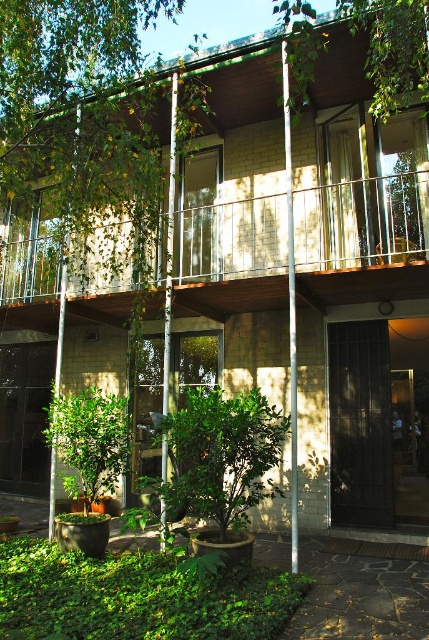
Is green wood balcony at upper center below green leafy plant at lower center?

Incorrect, green wood balcony at upper center is not positioned below green leafy plant at lower center.

This screenshot has width=429, height=640. Describe the element at coordinates (202, 189) in the screenshot. I see `green wood balcony at upper center` at that location.

Locate an element on the screen. green wood balcony at upper center is located at coordinates (202, 189).

Does green leafy tree at center appear on the right side of green leafy plant at lower center?

No, green leafy tree at center is not to the right of green leafy plant at lower center.

Locate an element on the screen. green leafy tree at center is located at coordinates (81, 115).

Describe the element at coordinates (81, 115) in the screenshot. This screenshot has width=429, height=640. I see `green leafy tree at center` at that location.

Find the location of a particular element. This screenshot has height=640, width=429. green leafy tree at center is located at coordinates (81, 115).

Looking at this image, can you confirm if green wood balcony at upper center is wider than green leafy tree at center?

Incorrect, green wood balcony at upper center's width does not surpass green leafy tree at center's.

What do you see at coordinates (202, 189) in the screenshot? The height and width of the screenshot is (640, 429). I see `green wood balcony at upper center` at bounding box center [202, 189].

This screenshot has height=640, width=429. Find the location of `green wood balcony at upper center`. green wood balcony at upper center is located at coordinates (202, 189).